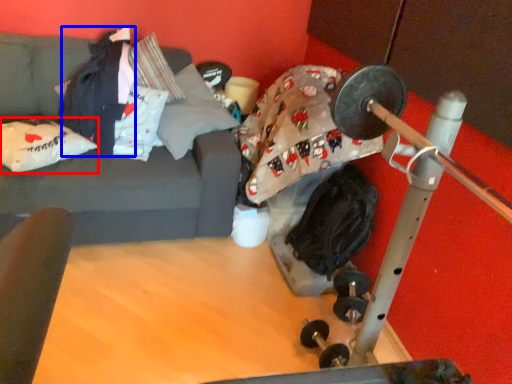
Question: Which point is closer to the camera, pillow (highlighted by a red box) or clothing (highlighted by a blue box)?

Choices:
 (A) pillow
 (B) clothing

Answer: (A)